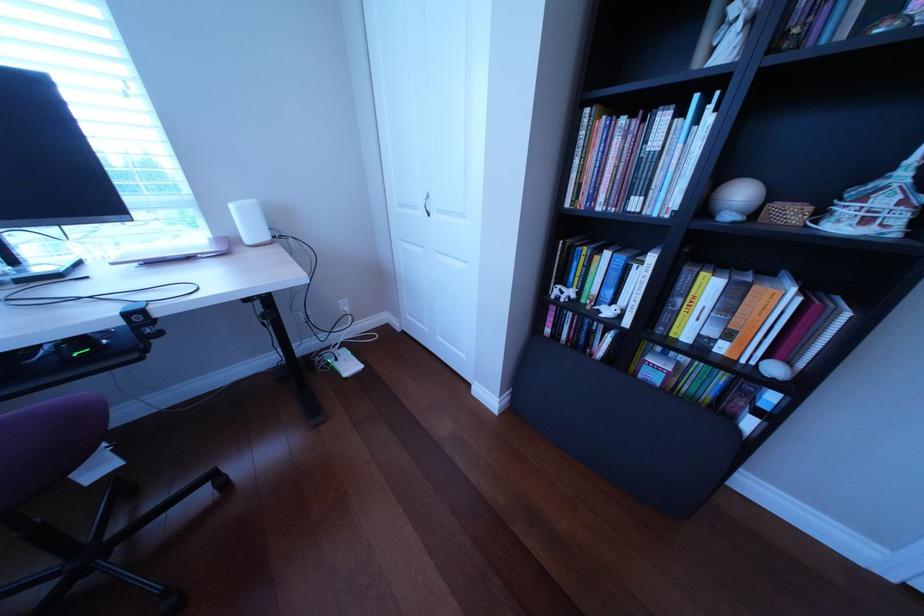
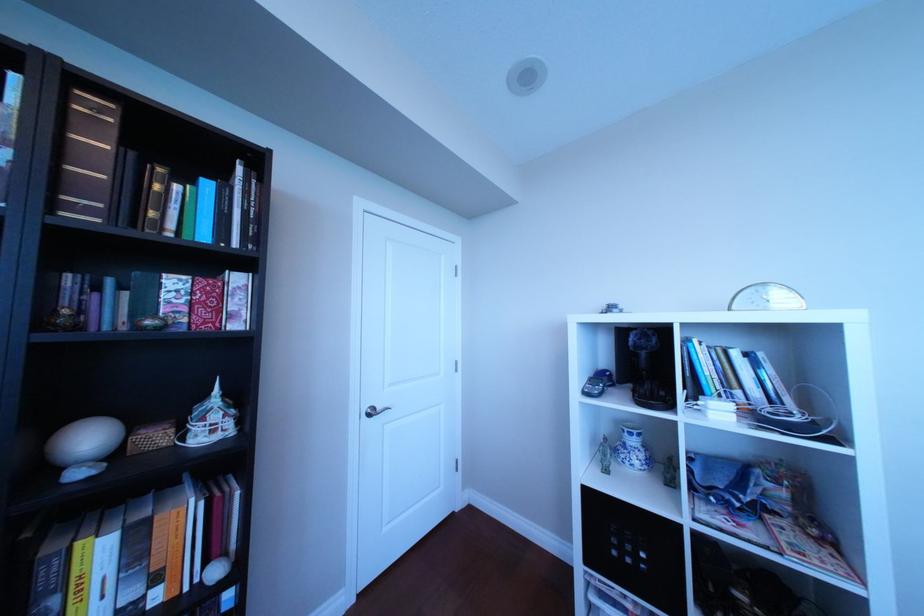
Question: The camera is either moving clockwise (left) or counter-clockwise (right) around the object. The first image is from the beginning of the video and the second image is from the end. Is the camera moving left or right when shooting the video?

Choices:
 (A) Left
 (B) Right

Answer: (A)